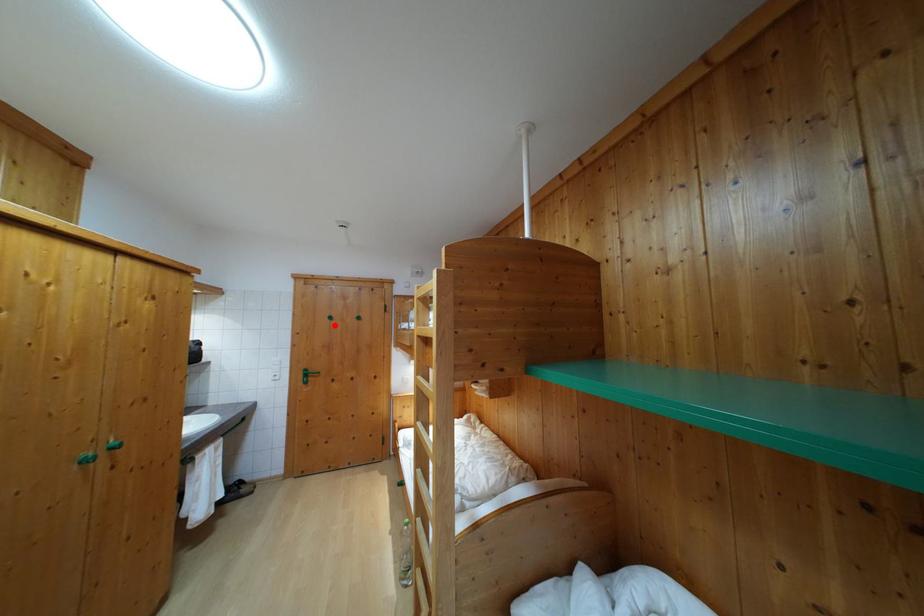
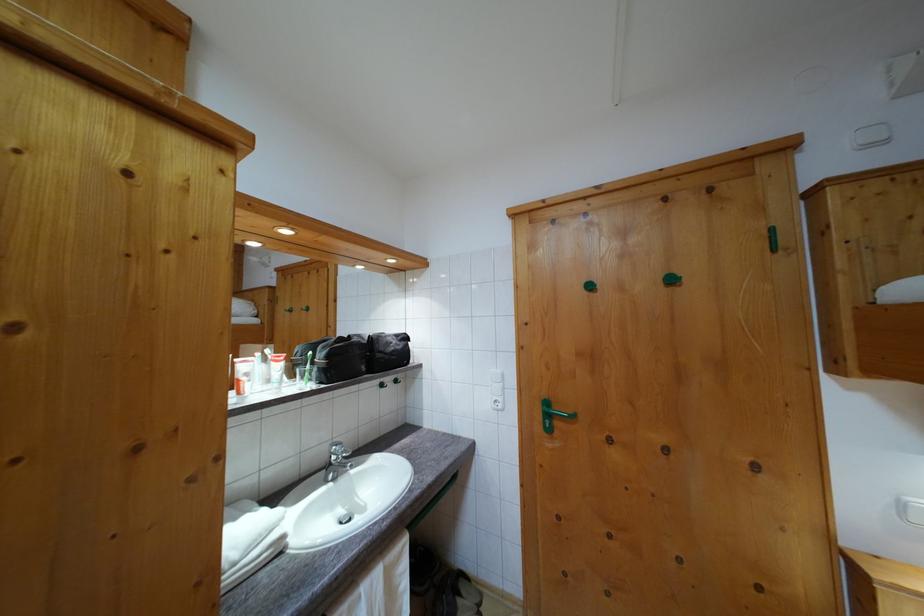
Find the pixel in the second image that matches the highlighted location in the first image.

(593, 294)